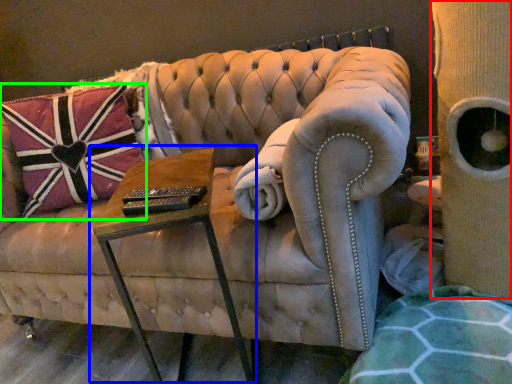
Question: Which object is the closest to the side (highlighted by a red box)? Choose among these: table (highlighted by a blue box) or pillow (highlighted by a green box).

Choices:
 (A) table
 (B) pillow

Answer: (A)